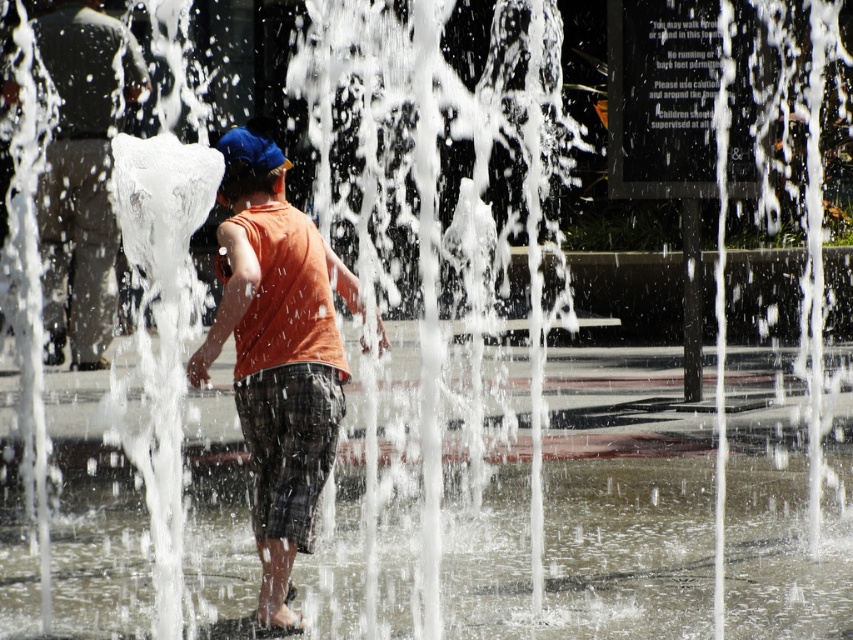
You are a photographer trying to capture the child in the water fountain scene. You notice the orange cotton tank top at center and orange sleeveless shirt at center. Which one is positioned lower on the child?

The orange cotton tank top at center is positioned lower on the child because it is below the orange sleeveless shirt at center.

You are a photographer trying to capture the child in the center of the image. The child is wearing an orange cotton tank top at center. The camera you are using has a focus point at point (277, 353). Will this focus point successfully capture the orange cotton tank top at center?

Yes, the orange cotton tank top at center is represented by point (277, 353), so the focus point at that coordinate will successfully capture it.